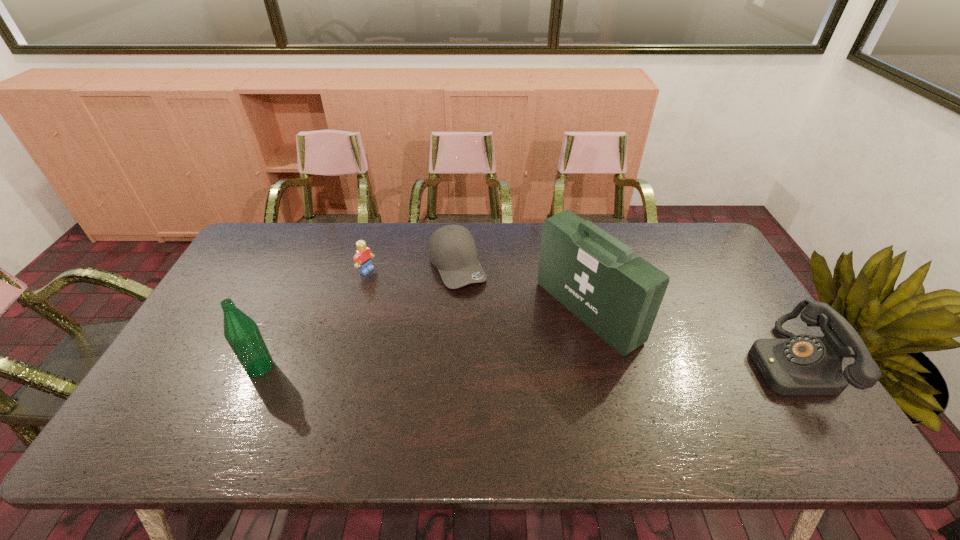
Image resolution: width=960 pixels, height=540 pixels. Identify the location of vacant area between the first-aid kit and the third tallest object. (688, 338).

Where is `unoccupied area between the Lego and the fourth object from left to right`? unoccupied area between the Lego and the fourth object from left to right is located at coordinates (477, 291).

This screenshot has height=540, width=960. Identify the location of free space between the third object from left to right and the leftmost object. (359, 316).

I want to click on free space between the second object from right to left and the baseball cap, so click(x=522, y=288).

Locate an element on the screen. This screenshot has height=540, width=960. vacant point located between the telephone and the leftmost object is located at coordinates (524, 366).

This screenshot has width=960, height=540. What are the coordinates of `empty space between the third tallest object and the first-aid kit` in the screenshot? It's located at (688, 338).

This screenshot has width=960, height=540. What are the coordinates of `object that is the closest to the telephone` in the screenshot? It's located at pos(595,276).

The image size is (960, 540). In order to click on the second closest object to the second object from left to right in this screenshot , I will do `click(241, 332)`.

The height and width of the screenshot is (540, 960). I want to click on vacant position in the image that satisfies the following two spatial constraints: 1. on the front side of the fourth object from left to right; 2. on the dial of the rightmost object, so click(601, 363).